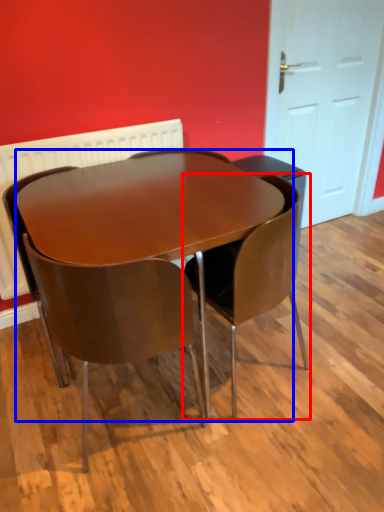
Question: Among these objects, which one is nearest to the camera, chair (highlighted by a red box) or table (highlighted by a blue box)?

Choices:
 (A) chair
 (B) table

Answer: (B)